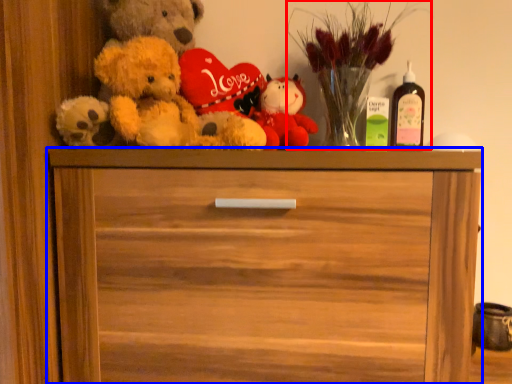
Question: Among these objects, which one is farthest to the camera, floral arrangement (highlighted by a red box) or chest of drawers (highlighted by a blue box)?

Choices:
 (A) floral arrangement
 (B) chest of drawers

Answer: (A)